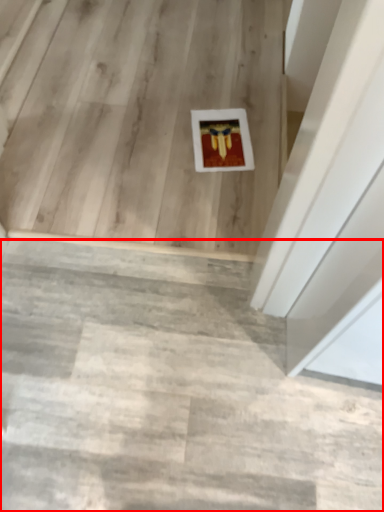
Question: From the image, what is the correct spatial relationship of stairwell (annotated by the red box) in relation to stairwell?

Choices:
 (A) right
 (B) left

Answer: (A)